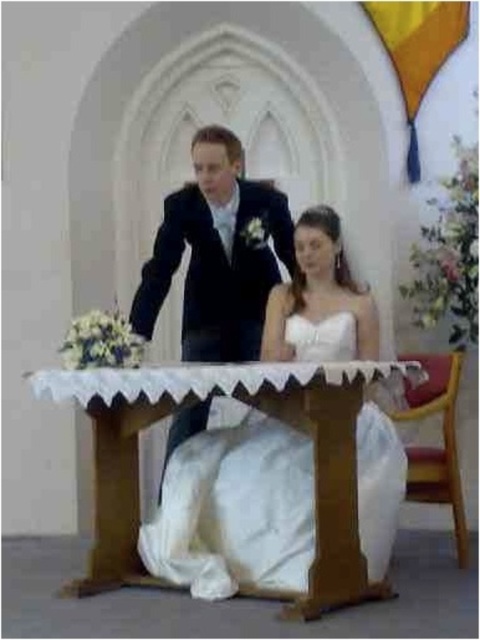
You are a photographer standing at the back of the church during the wedding. You need to capture a photo of the wooden table at center and the satin black suit at upper center. Given that your camera has a minimum focus distance of 3 feet, will you be able to take a clear photo of both subjects from your current position?

The distance between the wooden table at center and the satin black suit at upper center is 34.59 inches, which is approximately 2.88 feet. Since the camera requires a minimum focus distance of 3 feet, you will not be able to capture both subjects clearly from your current position as the distance is slightly shorter than the required minimum focus distance.

You are a photographer at the wedding and want to capture a closeup shot of the white satin dress at center. You have a camera with a 100mm lens. Considering the wooden table at center is between you and the dress, can you fit the entire dress in the frame without moving the table?

The wooden table at center is bigger than the white satin dress at center. Since the table is larger, it might block part of the dress. To ensure the entire dress fits, you might need to adjust your position or use a wider lens to capture both the table and the dress without obstruction.